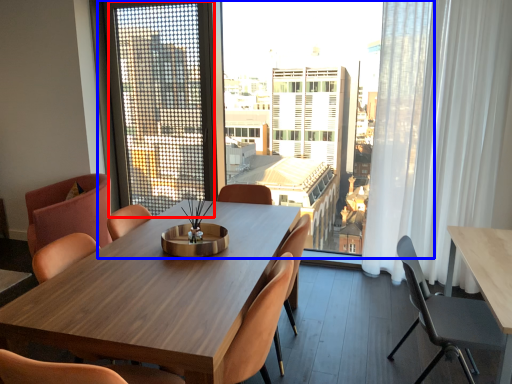
Question: Which object appears closest to the camera in this image, screen door (highlighted by a red box) or window (highlighted by a blue box)?

Choices:
 (A) screen door
 (B) window

Answer: (B)